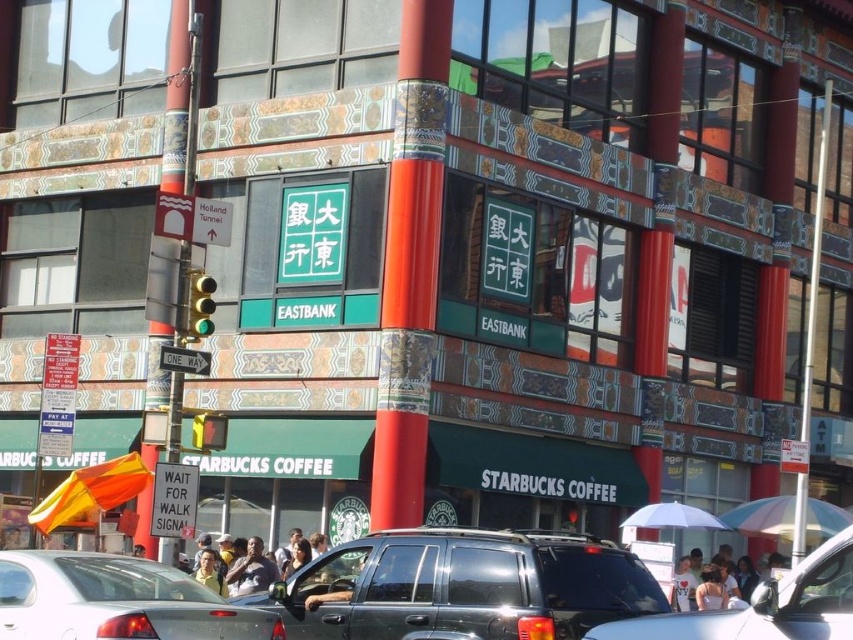
Question: Does metallic silver suv at center appear on the right side of rainbow striped umbrella at lower right?

Choices:
 (A) no
 (B) yes

Answer: (A)

Question: Which of the following is the closest to the observer?

Choices:
 (A) (694, 548)
 (B) (207, 332)

Answer: (B)

Question: Which point appears closest to the camera in this image?

Choices:
 (A) (200, 433)
 (B) (260, 520)

Answer: (A)

Question: Does white cotton shirt at lower right appear on the left side of yellow matte traffic light at center?

Choices:
 (A) no
 (B) yes

Answer: (A)

Question: Which point is closer to the camera taking this photo?

Choices:
 (A) (670, 518)
 (B) (380, 312)
 (C) (778, 538)
 (D) (202, 518)

Answer: (A)

Question: From the image, what is the correct spatial relationship of metallic silver suv at center in relation to orange fabric umbrella at center?

Choices:
 (A) right
 (B) left

Answer: (A)